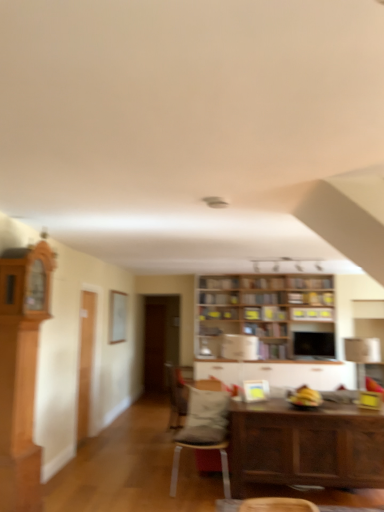
Question: Is the depth of wooden table at lower right less than that of wooden bookshelf at center, which ranks as the fourth shelf in top-to-bottom order?

Choices:
 (A) no
 (B) yes

Answer: (B)

Question: Is wooden table at lower right wider than wooden bookshelf at center, the 1th shelf when ordered from bottom to top?

Choices:
 (A) yes
 (B) no

Answer: (A)

Question: Are wooden table at lower right and wooden bookshelf at center, the 1th shelf when ordered from bottom to top, beside each other?

Choices:
 (A) no
 (B) yes

Answer: (A)

Question: Is wooden table at lower right aimed at wooden bookshelf at center, the 1th shelf when ordered from bottom to top?

Choices:
 (A) yes
 (B) no

Answer: (B)

Question: Is wooden table at lower right to the left of wooden bookshelf at center, the 1th shelf when ordered from bottom to top, from the viewer's perspective?

Choices:
 (A) no
 (B) yes

Answer: (B)

Question: Is wooden table at lower right outside wooden bookshelf at center, the 1th shelf when ordered from bottom to top?

Choices:
 (A) no
 (B) yes

Answer: (B)

Question: Is velvet gray chair at center, placed as the second chair when sorted from front to back, far away from wooden bookshelf at center, which ranks as the first shelf in top-to-bottom order?

Choices:
 (A) yes
 (B) no

Answer: (A)

Question: Is velvet gray chair at center, placed as the second chair when sorted from front to back, completely or partially outside of wooden bookshelf at center, the 4th shelf when ordered from bottom to top?

Choices:
 (A) yes
 (B) no

Answer: (A)

Question: Is wooden bookshelf at center, which ranks as the first shelf in top-to-bottom order, inside velvet gray chair at center, placed as the second chair when sorted from front to back?

Choices:
 (A) yes
 (B) no

Answer: (B)

Question: Does velvet gray chair at center, the first chair positioned from the back, have a greater width compared to wooden bookshelf at center, which ranks as the first shelf in top-to-bottom order?

Choices:
 (A) no
 (B) yes

Answer: (B)

Question: From a real-world perspective, is velvet gray chair at center, placed as the second chair when sorted from front to back, positioned over wooden bookshelf at center, which ranks as the first shelf in top-to-bottom order, based on gravity?

Choices:
 (A) yes
 (B) no

Answer: (B)

Question: Does velvet gray chair at center, placed as the second chair when sorted from front to back, lie behind wooden bookshelf at center, which ranks as the first shelf in top-to-bottom order?

Choices:
 (A) yes
 (B) no

Answer: (B)

Question: Is wooden bookshelf at center, the 3th shelf positioned from the top, to the right of wooden table at lower right from the viewer's perspective?

Choices:
 (A) no
 (B) yes

Answer: (A)